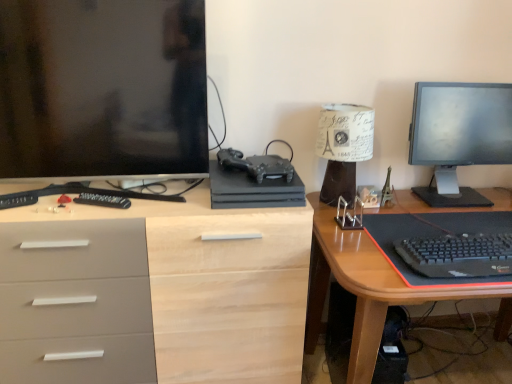
Where is `vacant space to the right of black plastic remote control at left, the first remote control in the left-to-right sequence`? This screenshot has height=384, width=512. vacant space to the right of black plastic remote control at left, the first remote control in the left-to-right sequence is located at coordinates (42, 210).